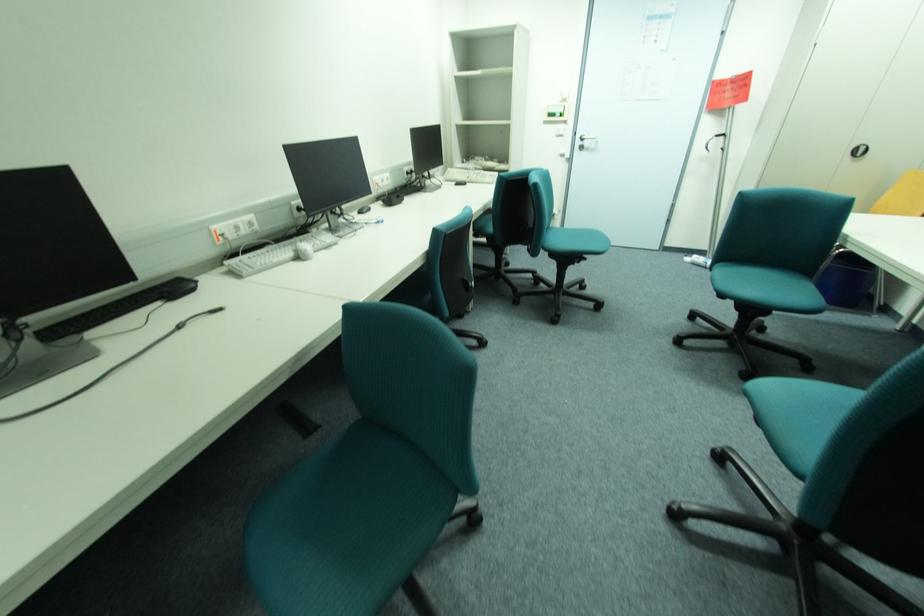
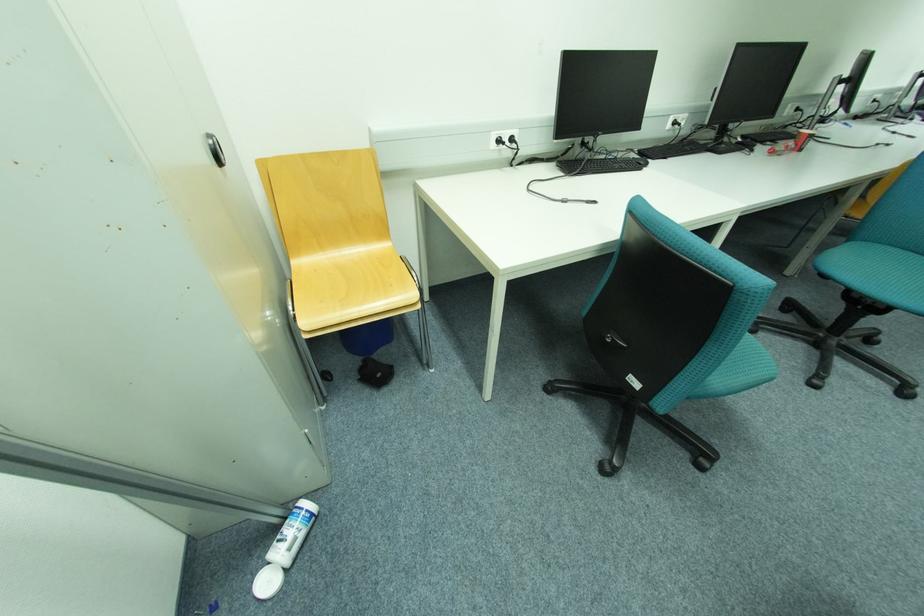
Locate, in the second image, the point that corresponds to [695,259] in the first image.

(274, 584)